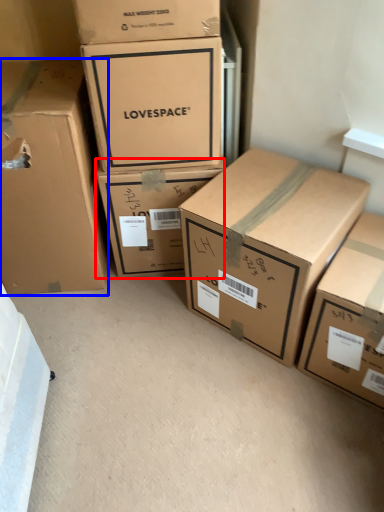
Question: Which point is further to the camera, box (highlighted by a red box) or box (highlighted by a blue box)?

Choices:
 (A) box
 (B) box

Answer: (A)